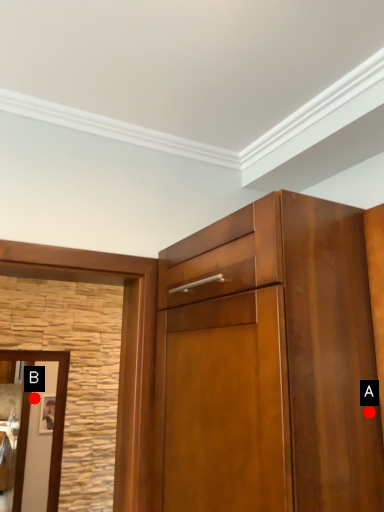
Question: Two points are circled on the image, labeled by A and B beside each circle. Which point is closer to the camera taking this photo?

Choices:
 (A) A is closer
 (B) B is closer

Answer: (A)